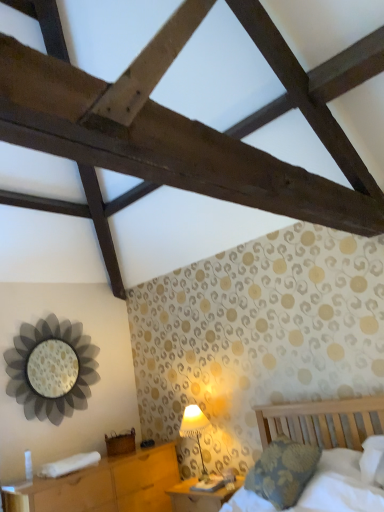
Question: Would you say metallic flower-shaped mirror at left is part of wooden bed at lower right's contents?

Choices:
 (A) yes
 (B) no

Answer: (B)

Question: Is wooden bed at lower right taller than metallic flower-shaped mirror at left?

Choices:
 (A) yes
 (B) no

Answer: (B)

Question: Is wooden bed at lower right shorter than metallic flower-shaped mirror at left?

Choices:
 (A) yes
 (B) no

Answer: (A)

Question: Is wooden bed at lower right behind metallic flower-shaped mirror at left?

Choices:
 (A) no
 (B) yes

Answer: (A)

Question: Considering the relative sizes of wooden bed at lower right and metallic flower-shaped mirror at left in the image provided, is wooden bed at lower right bigger than metallic flower-shaped mirror at left?

Choices:
 (A) no
 (B) yes

Answer: (B)

Question: From the image's perspective, is wooden bed at lower right under metallic flower-shaped mirror at left?

Choices:
 (A) no
 (B) yes

Answer: (B)

Question: From a real-world perspective, is wooden nightstand at lower left, which appears as the first nightstand when viewed from the left, physically below wooden bed at lower right?

Choices:
 (A) no
 (B) yes

Answer: (B)

Question: From a real-world perspective, is wooden nightstand at lower left, which appears as the first nightstand when viewed from the left, physically above wooden bed at lower right?

Choices:
 (A) no
 (B) yes

Answer: (A)

Question: Is wooden nightstand at lower left, the 2th nightstand when ordered from right to left, taller than wooden bed at lower right?

Choices:
 (A) no
 (B) yes

Answer: (B)

Question: Does wooden nightstand at lower left, which appears as the first nightstand when viewed from the left, have a larger size compared to wooden bed at lower right?

Choices:
 (A) no
 (B) yes

Answer: (B)

Question: From the image's perspective, is wooden nightstand at lower left, the 2th nightstand when ordered from right to left, beneath wooden bed at lower right?

Choices:
 (A) no
 (B) yes

Answer: (B)

Question: Would you say wooden nightstand at lower left, the 2th nightstand when ordered from right to left, contains wooden bed at lower right?

Choices:
 (A) yes
 (B) no

Answer: (B)

Question: Does wooden nightstand at lower left, the 2th nightstand when ordered from right to left, come in front of wooden nightstand at lower center, positioned as the 2th nightstand in left-to-right order?

Choices:
 (A) yes
 (B) no

Answer: (A)